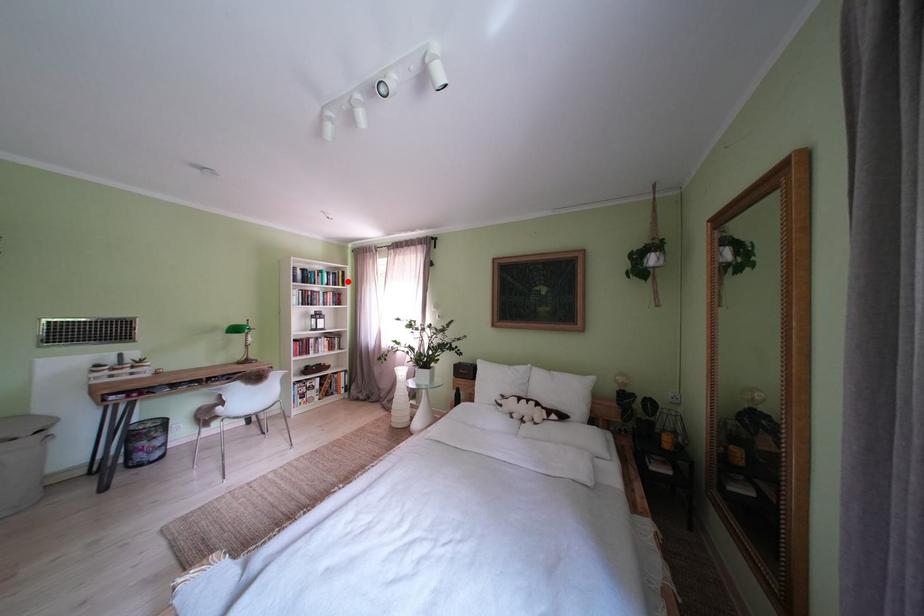
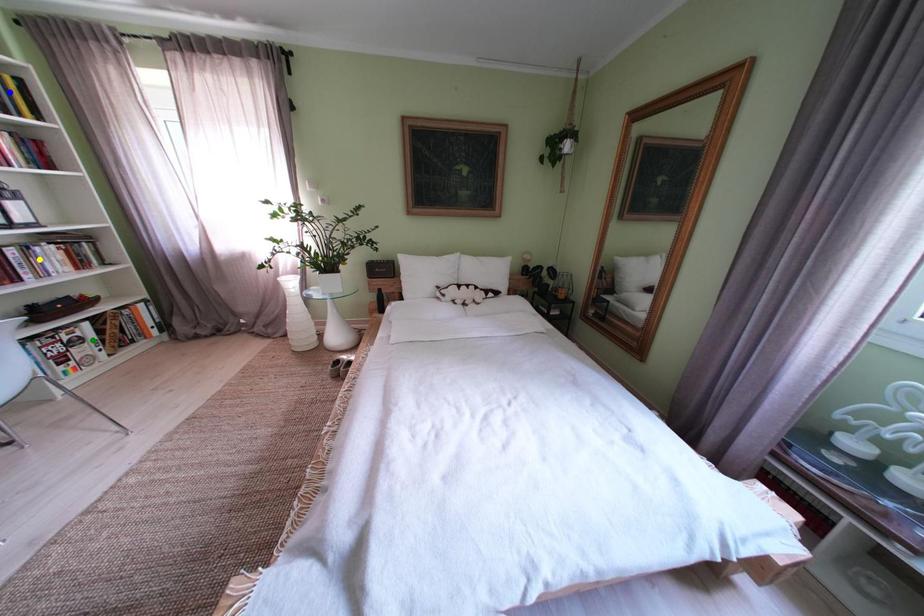
Question: I am providing you with two images of the same scene from different viewpoints. A red point is marked on the first image. You are given multiple points on the second image. Can you choose the point in image 2 that corresponds to the point in image 1?

Choices:
 (A) yellow point
 (B) blue point
 (C) green point

Answer: (B)